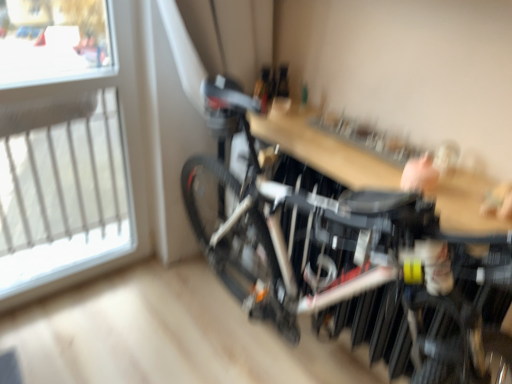
This screenshot has height=384, width=512. What are the coordinates of `vacant space underneath transparent glass window at upper left (from a real-world perspective)` in the screenshot? It's located at (82, 288).